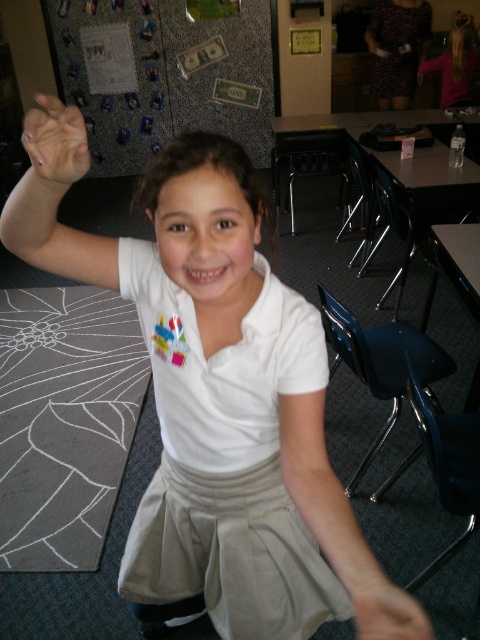
You are a photographer trying to capture a clear shot of the white cotton dress at center and the matte white arm at upper left. Which object is closer to the camera?

The white cotton dress at center is closer to the camera than the matte white arm at upper left because the matte white arm at upper left is positioned behind it.

You are a student in the classroom and want to know which arm is thinner between the white fabric arm at lower center and the matte white arm at upper left. Can you tell me?

The white fabric arm at lower center has a lesser width compared to the matte white arm at upper left, so the white fabric arm at lower center is thinner.

You are a photographer setting up for a school photo. The subject is wearing a white cotton dress at center and has a matte skin hand at upper left. You need to adjust the lighting so that the distance between the dress and the hand is highlighted. Is the dress closer to the hand than 27 inches?

The white cotton dress at center is 26.08 inches from matte skin hand at upper left, which is less than 27 inches. Therefore, the dress is closer to the hand than 27 inches.